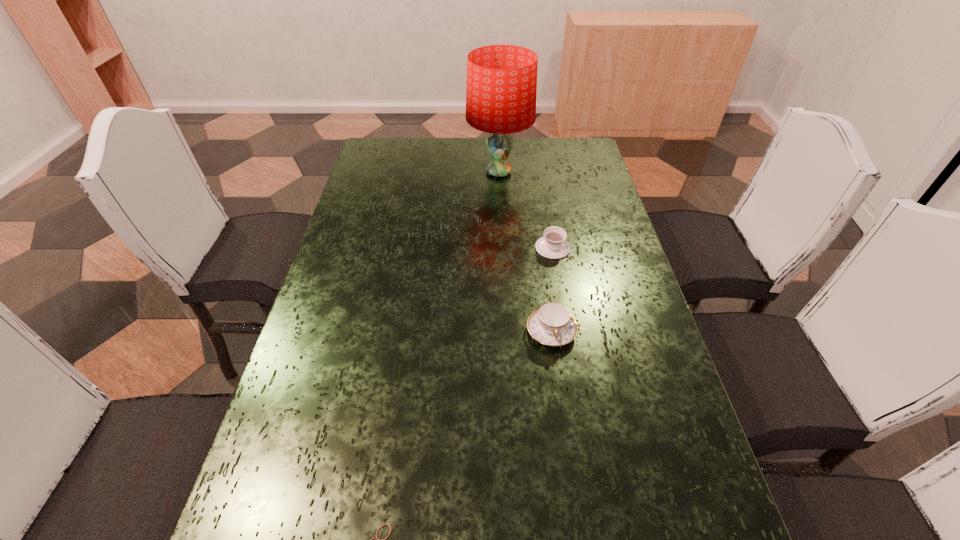
You are a GUI agent. You are given a task and a screenshot of the screen. Output one action in this format:
    pyautogui.click(x=<x>, y=<y>)
    Task: Click on the vacant region located 0.080m on the handle side of the third tallest object
    The width and height of the screenshot is (960, 540).
    Given the screenshot: What is the action you would take?
    pyautogui.click(x=548, y=220)

At what (x,y) coordinates should I click in order to perform the action: click on free space located 0.100m on the handle side of the third tallest object. Please return your answer as a coordinate pair (x, y). Looking at the image, I should click on (547, 216).

Where is `vacant space located 0.330m on the handle side of the third tallest object`? vacant space located 0.330m on the handle side of the third tallest object is located at coordinates (540, 176).

The height and width of the screenshot is (540, 960). Find the location of `object located at the far edge`. object located at the far edge is located at coordinates (501, 90).

Locate an element on the screen. Image resolution: width=960 pixels, height=540 pixels. object that is at the right edge is located at coordinates (553, 245).

At what (x,y) coordinates should I click in order to perform the action: click on free space at the left edge of the desktop. Please return your answer as a coordinate pair (x, y). The image size is (960, 540). Looking at the image, I should click on (372, 221).

What are the coordinates of `vacant space at the right edge of the desktop` in the screenshot? It's located at (627, 261).

You are a GUI agent. You are given a task and a screenshot of the screen. Output one action in this format:
    pyautogui.click(x=<x>, y=<y>)
    Task: Click on the vacant area between the second shortest object and the third shortest object
    The image size is (960, 540).
    Given the screenshot: What is the action you would take?
    pyautogui.click(x=552, y=289)

Identify the location of free space that is in between the third shortest object and the farthest object. (525, 252).

The image size is (960, 540). Identify the location of vacant space in between the farthest object and the second farthest object. click(x=526, y=210).